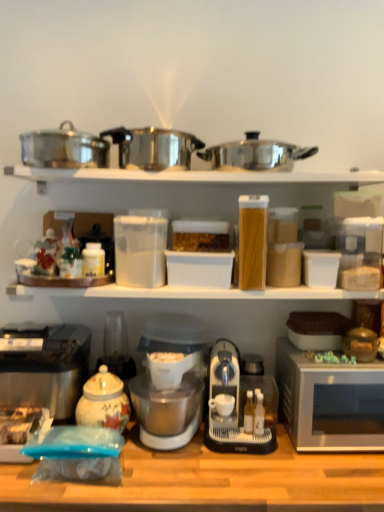
Locate an element on the screen. free spot in front of white plastic coffee maker at center is located at coordinates (183, 480).